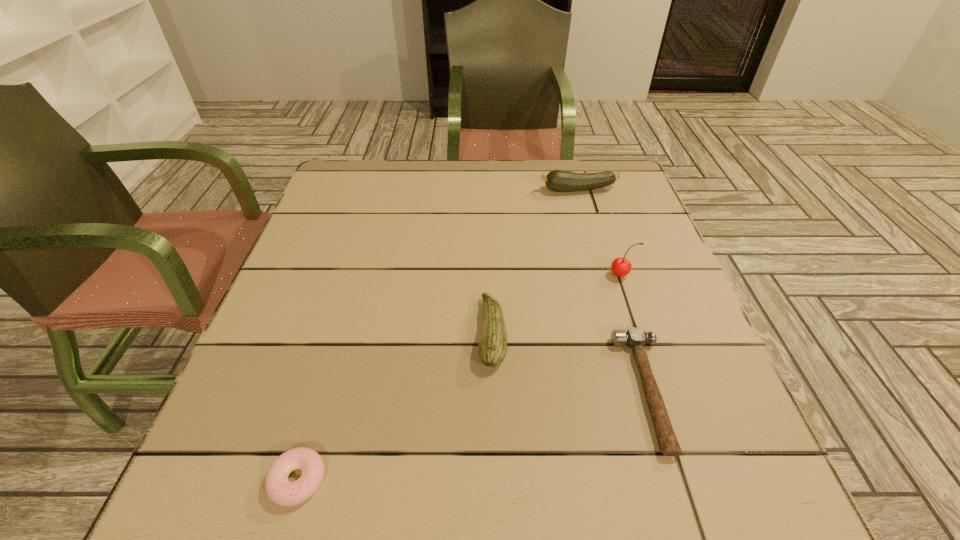
What are the coordinates of `vacant space at the left edge` in the screenshot? It's located at (297, 301).

At what (x,y) coordinates should I click in order to perform the action: click on free location at the right edge of the desktop. Please return your answer as a coordinate pair (x, y). This screenshot has width=960, height=540. Looking at the image, I should click on (651, 415).

Where is `vacant space at the far left corner of the desktop`? Image resolution: width=960 pixels, height=540 pixels. vacant space at the far left corner of the desktop is located at coordinates (379, 173).

Image resolution: width=960 pixels, height=540 pixels. In order to click on vacant region at the far right corner of the desktop in this screenshot , I will do `click(626, 200)`.

In the image, there is a desktop. What are the coordinates of `vacant area at the near right corner` in the screenshot? It's located at (673, 487).

Where is `free space between the doughnut and the hammer`? free space between the doughnut and the hammer is located at coordinates (472, 435).

This screenshot has width=960, height=540. I want to click on vacant space that's between the fourth nearest object and the farthest object, so click(600, 232).

The width and height of the screenshot is (960, 540). I want to click on free point between the left zucchini and the doughnut, so click(395, 406).

The height and width of the screenshot is (540, 960). What are the coordinates of `empty location between the second object from left to right and the tallest object` in the screenshot? It's located at (557, 303).

Image resolution: width=960 pixels, height=540 pixels. In order to click on free space that is in between the doughnut and the nearer zucchini in this screenshot , I will do `click(395, 406)`.